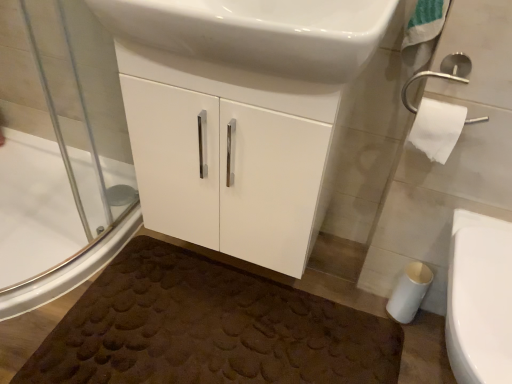
Locate an element on the screen. vacant area on the back side of transparent glass shower door at left is located at coordinates (79, 198).